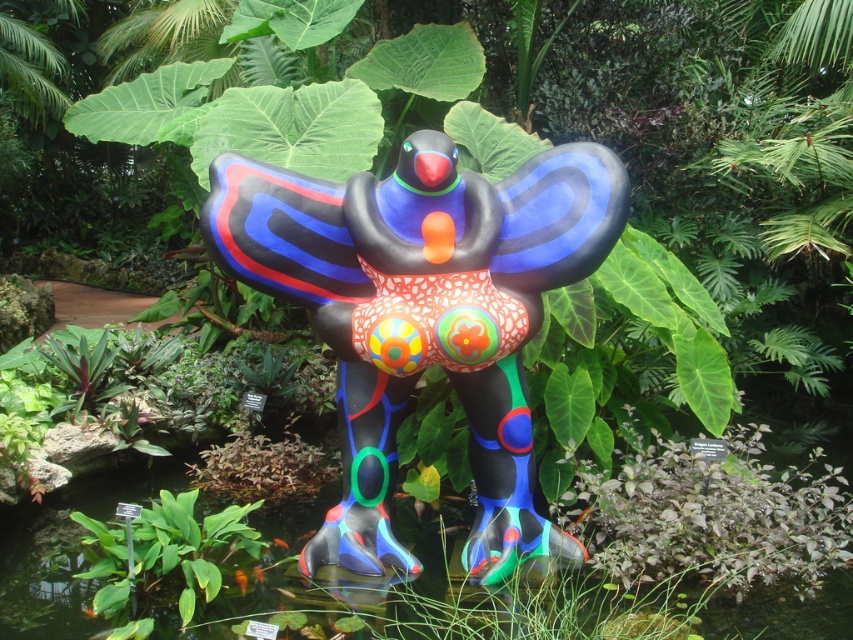
You are a gardener standing in front of the sculpture. You need to water the green leafy plant at lower center. Can you reach it without moving the glossy plastic bird at center?

The green leafy plant at lower center is behind the glossy plastic bird at center, so you can reach it by moving around the sides or back of the glossy plastic bird at center to access the plant.

You are a photographer standing at the camera position. You want to capture a closeup shot of the glossy plastic bird at center. Given that your camera has a minimum focusing distance of 10 feet, will you be able to take the photo without moving closer?

The glossy plastic bird at center and camera are 9.66 feet apart from each other. Since the minimum focusing distance is 10 feet, you are currently 0.34 feet too close to focus properly. You need to move back approximately 0.34 feet to achieve a clear closeup shot.

You are a gardener who wants to install a new light fixture above the glossy plastic bird at center and the green leafy plant at lower center. Since you need to ensure the light is tall enough to cover both, which object requires the light to be placed higher?

The glossy plastic bird at center requires the light to be placed higher because it has a greater height compared to the green leafy plant at lower center.